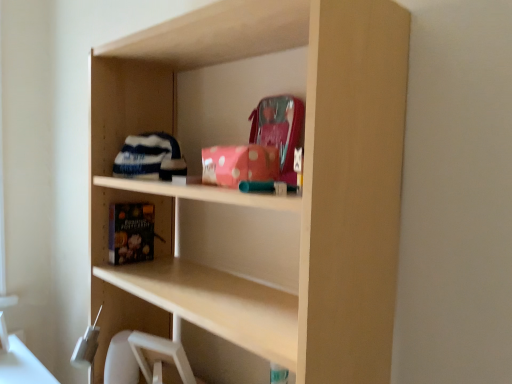
What is the approximate height of black matte book at lower left, which is counted as the second book, starting from the top?

It is 18.80 centimeters.

Where is `black matte book at lower left, which is the 1th book from left to right`? black matte book at lower left, which is the 1th book from left to right is located at coordinates (131, 232).

This screenshot has height=384, width=512. What do you see at coordinates (131, 232) in the screenshot?
I see `black matte book at lower left, placed as the first book when sorted from bottom to top` at bounding box center [131, 232].

Based on the photo, measure the distance between point (x=124, y=210) and camera.

Point (x=124, y=210) and camera are 4.08 feet apart.

Consider the image. Measure the distance between pink polka dot fabric at upper center, acting as the 2th book starting from the back, and camera.

The depth of pink polka dot fabric at upper center, acting as the 2th book starting from the back, is 31.89 inches.

At what (x,y) coordinates should I click in order to perform the action: click on pink polka dot fabric at upper center, the second book positioned from the left. Please return your answer as a coordinate pair (x, y). Looking at the image, I should click on (x=239, y=164).

The height and width of the screenshot is (384, 512). Describe the element at coordinates (239, 164) in the screenshot. I see `pink polka dot fabric at upper center, the second book positioned from the left` at that location.

This screenshot has width=512, height=384. In order to click on black matte book at lower left, marked as the 2th book in a right-to-left arrangement in this screenshot , I will do `click(131, 232)`.

Which is more to the right, pink polka dot fabric at upper center, the second book positioned from the left, or black matte book at lower left, which is counted as the second book, starting from the top?

pink polka dot fabric at upper center, the second book positioned from the left, is more to the right.

Between pink polka dot fabric at upper center, the 1th book positioned from the top, and black matte book at lower left, the 1th book in the back-to-front sequence, which one is positioned behind?

black matte book at lower left, the 1th book in the back-to-front sequence, is behind.

Is point (234, 156) positioned behind point (118, 214)?

No, (234, 156) is in front of (118, 214).

From the image's perspective, is pink polka dot fabric at upper center, arranged as the 1th book when viewed from the front, located beneath black matte book at lower left, the 2th book viewed from the front?

No.

From a real-world perspective, is pink polka dot fabric at upper center, arranged as the 1th book when viewed from the front, physically below black matte book at lower left, placed as the first book when sorted from bottom to top?

No.

Which of these two, pink polka dot fabric at upper center, the first book when ordered from right to left, or black matte book at lower left, which is counted as the second book, starting from the top, is thinner?

pink polka dot fabric at upper center, the first book when ordered from right to left, is thinner.

In terms of height, does pink polka dot fabric at upper center, placed as the 2th book when sorted from bottom to top, look taller or shorter compared to black matte book at lower left, which is counted as the second book, starting from the top?

Considering their sizes, pink polka dot fabric at upper center, placed as the 2th book when sorted from bottom to top, has less height than black matte book at lower left, which is counted as the second book, starting from the top.

From the picture: Is pink polka dot fabric at upper center, placed as the 2th book when sorted from bottom to top, smaller than black matte book at lower left, which is the 1th book from left to right?

No, pink polka dot fabric at upper center, placed as the 2th book when sorted from bottom to top, is not smaller than black matte book at lower left, which is the 1th book from left to right.

Is pink polka dot fabric at upper center, arranged as the 1th book when viewed from the front, inside the boundaries of black matte book at lower left, which is counted as the second book, starting from the top, or outside?

pink polka dot fabric at upper center, arranged as the 1th book when viewed from the front, lies outside black matte book at lower left, which is counted as the second book, starting from the top.

Is pink polka dot fabric at upper center, acting as the 2th book starting from the back, positioned far away from black matte book at lower left, the 2th book viewed from the front?

That's not correct — pink polka dot fabric at upper center, acting as the 2th book starting from the back, is a little close to black matte book at lower left, the 2th book viewed from the front.

Is pink polka dot fabric at upper center, arranged as the 1th book when viewed from the front, aimed at black matte book at lower left, the 1th book in the back-to-front sequence?

No.

Could you measure the distance between pink polka dot fabric at upper center, arranged as the 1th book when viewed from the front, and black matte book at lower left, placed as the first book when sorted from bottom to top?

pink polka dot fabric at upper center, arranged as the 1th book when viewed from the front, and black matte book at lower left, placed as the first book when sorted from bottom to top, are 45.14 centimeters apart.

This screenshot has width=512, height=384. I want to click on book below the pink polka dot fabric at upper center, acting as the 2th book starting from the back (from a real-world perspective), so click(131, 232).

Would you say black matte book at lower left, which is the 1th book from left to right, is to the left or to the right of pink polka dot fabric at upper center, arranged as the 1th book when viewed from the front, in the picture?

In the image, black matte book at lower left, which is the 1th book from left to right, appears on the left side of pink polka dot fabric at upper center, arranged as the 1th book when viewed from the front.

Is black matte book at lower left, which is the 1th book from left to right, closer to camera compared to pink polka dot fabric at upper center, placed as the 2th book when sorted from bottom to top?

No.

Between point (113, 223) and point (205, 148), which one is positioned behind?

The point (205, 148) is behind.

From the image's perspective, between black matte book at lower left, which is counted as the second book, starting from the top, and pink polka dot fabric at upper center, the first book when ordered from right to left, who is located below?

black matte book at lower left, which is counted as the second book, starting from the top, is shown below in the image.

From a real-world perspective, who is located higher, black matte book at lower left, the 2th book viewed from the front, or pink polka dot fabric at upper center, the second book positioned from the left?

From a 3D spatial view, pink polka dot fabric at upper center, the second book positioned from the left, is above.

Considering the relative sizes of black matte book at lower left, the 1th book in the back-to-front sequence, and pink polka dot fabric at upper center, the first book when ordered from right to left, in the image provided, is black matte book at lower left, the 1th book in the back-to-front sequence, wider than pink polka dot fabric at upper center, the first book when ordered from right to left,?

Correct, the width of black matte book at lower left, the 1th book in the back-to-front sequence, exceeds that of pink polka dot fabric at upper center, the first book when ordered from right to left.

Can you confirm if black matte book at lower left, which is counted as the second book, starting from the top, is shorter than pink polka dot fabric at upper center, acting as the 2th book starting from the back?

Incorrect, the height of black matte book at lower left, which is counted as the second book, starting from the top, does not fall short of that of pink polka dot fabric at upper center, acting as the 2th book starting from the back.

Based on their sizes in the image, would you say black matte book at lower left, marked as the 2th book in a right-to-left arrangement, is bigger or smaller than pink polka dot fabric at upper center, the first book when ordered from right to left?

Clearly, black matte book at lower left, marked as the 2th book in a right-to-left arrangement, is smaller in size than pink polka dot fabric at upper center, the first book when ordered from right to left.

Is black matte book at lower left, the 2th book viewed from the front, not inside pink polka dot fabric at upper center, arranged as the 1th book when viewed from the front?

black matte book at lower left, the 2th book viewed from the front, lies outside pink polka dot fabric at upper center, arranged as the 1th book when viewed from the front,'s area.

Would you consider black matte book at lower left, the 1th book in the back-to-front sequence, to be distant from pink polka dot fabric at upper center, arranged as the 1th book when viewed from the front?

black matte book at lower left, the 1th book in the back-to-front sequence, is near pink polka dot fabric at upper center, arranged as the 1th book when viewed from the front, not far away.

Could you tell me if black matte book at lower left, placed as the first book when sorted from bottom to top, is facing pink polka dot fabric at upper center, acting as the 2th book starting from the back?

No, black matte book at lower left, placed as the first book when sorted from bottom to top, is not facing towards pink polka dot fabric at upper center, acting as the 2th book starting from the back.

How different are the orientations of black matte book at lower left, marked as the 2th book in a right-to-left arrangement, and pink polka dot fabric at upper center, placed as the 2th book when sorted from bottom to top, in degrees?

The angle between the facing direction of black matte book at lower left, marked as the 2th book in a right-to-left arrangement, and the facing direction of pink polka dot fabric at upper center, placed as the 2th book when sorted from bottom to top, is 1.8 degrees.

Could you measure the distance between black matte book at lower left, placed as the first book when sorted from bottom to top, and pink polka dot fabric at upper center, placed as the 2th book when sorted from bottom to top?

black matte book at lower left, placed as the first book when sorted from bottom to top, and pink polka dot fabric at upper center, placed as the 2th book when sorted from bottom to top, are 17.77 inches apart.

Identify the location of book located above the black matte book at lower left, which is the 1th book from left to right (from the image's perspective). (239, 164).

What are the coordinates of `book that appears on the right of black matte book at lower left, placed as the first book when sorted from bottom to top` in the screenshot? It's located at (239, 164).

There is a black matte book at lower left, which is the 1th book from left to right. Where is `book above it (from a real-world perspective)`? The image size is (512, 384). book above it (from a real-world perspective) is located at coordinates (239, 164).